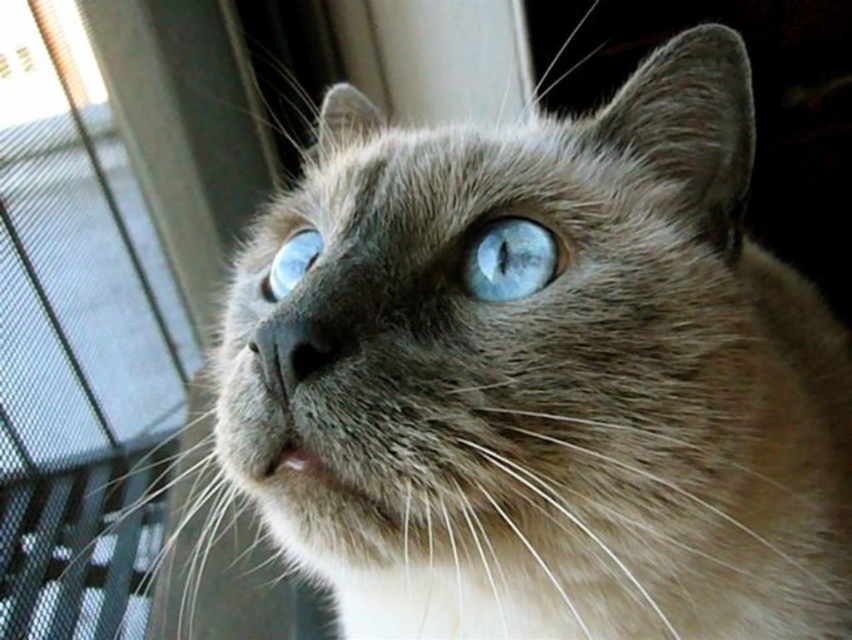
Is blue glossy eye at center below blue glossy eye at upper center?

Yes, blue glossy eye at center is below blue glossy eye at upper center.

In the scene shown: How far apart are blue glossy eye at center and blue glossy eye at upper center?

A distance of 7.56 inches exists between blue glossy eye at center and blue glossy eye at upper center.

Where is `blue glossy eye at center`? This screenshot has width=852, height=640. blue glossy eye at center is located at coordinates (510, 259).

Can you confirm if transparent glass door at left is thinner than blue glossy eye at upper center?

Incorrect, transparent glass door at left's width is not less than blue glossy eye at upper center's.

Find the location of `transparent glass door at left`. transparent glass door at left is located at coordinates [76, 344].

What are the coordinates of `transparent glass door at left` in the screenshot? It's located at (76, 344).

Which is above, transparent glass door at left or blue glossy eye at center?

blue glossy eye at center

Does point (9, 132) come farther from viewer compared to point (481, 282)?

Yes, it is.

Between point (26, 60) and point (540, 227), which one is positioned in front?

Point (540, 227) is more forward.

Where is `transparent glass door at left`? transparent glass door at left is located at coordinates (76, 344).